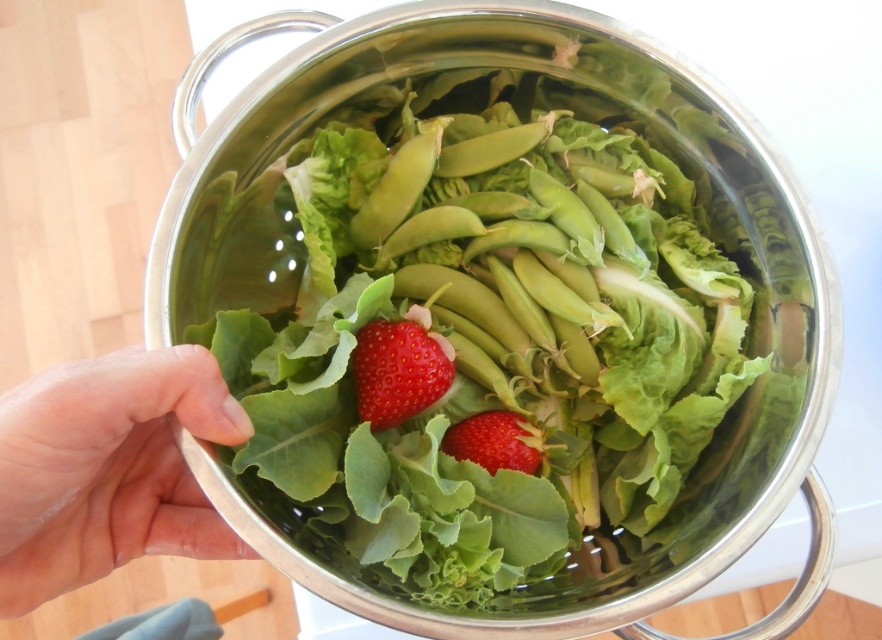
Can you confirm if pink flesh at center is positioned to the right of glossy red strawberry at center?

Incorrect, pink flesh at center is not on the right side of glossy red strawberry at center.

Is pink flesh at center above glossy red strawberry at center?

No.

Where is `pink flesh at center`? pink flesh at center is located at coordinates (108, 470).

Is green matte salad at center thinner than pink flesh at center?

In fact, green matte salad at center might be wider than pink flesh at center.

How far apart are green matte salad at center and pink flesh at center?

A distance of 7.09 inches exists between green matte salad at center and pink flesh at center.

The height and width of the screenshot is (640, 882). I want to click on green matte salad at center, so click(481, 324).

The image size is (882, 640). Identify the location of green matte salad at center. (481, 324).

This screenshot has width=882, height=640. Identify the location of glossy red strawberry at center. (397, 371).

Who is more forward, [374,346] or [484,449]?

Point [374,346] is in front.

Where is `glossy red strawberry at center`? glossy red strawberry at center is located at coordinates (397, 371).